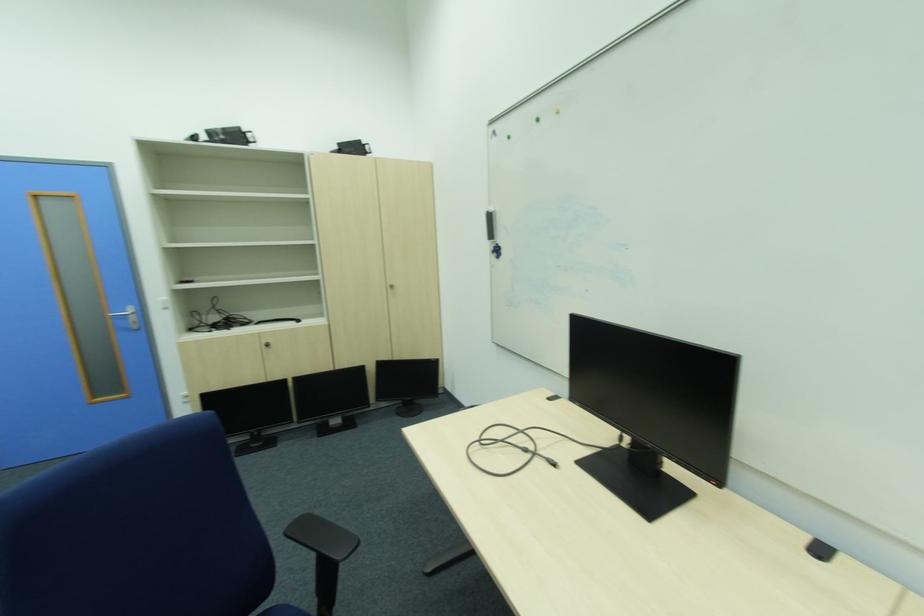
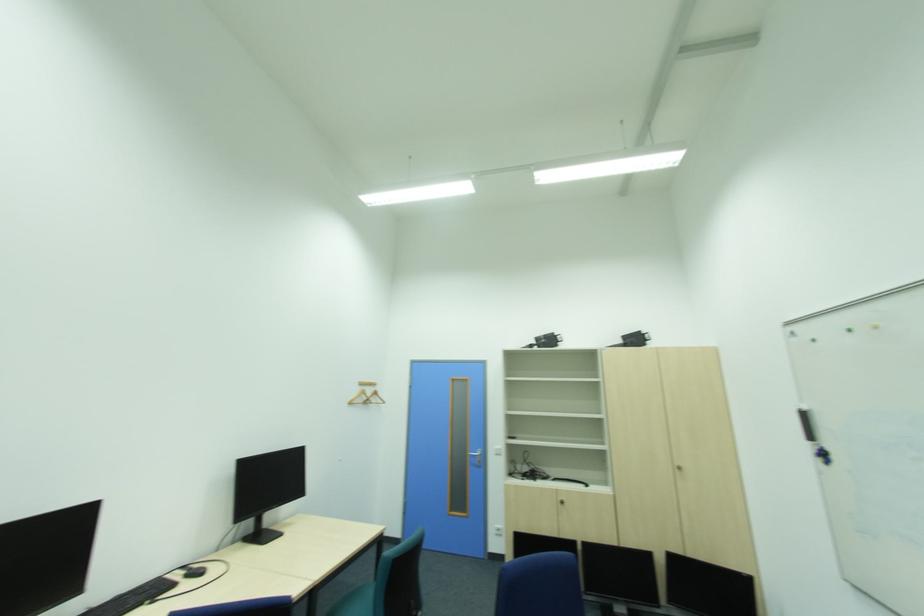
Based on the continuous images, in which direction is the camera rotating?

The rotation direction of the camera is left-up.